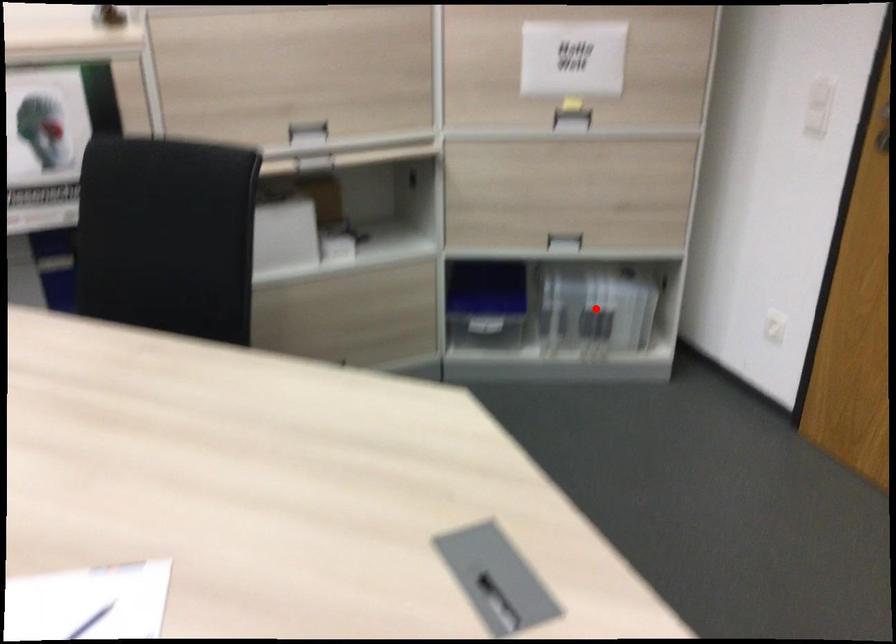
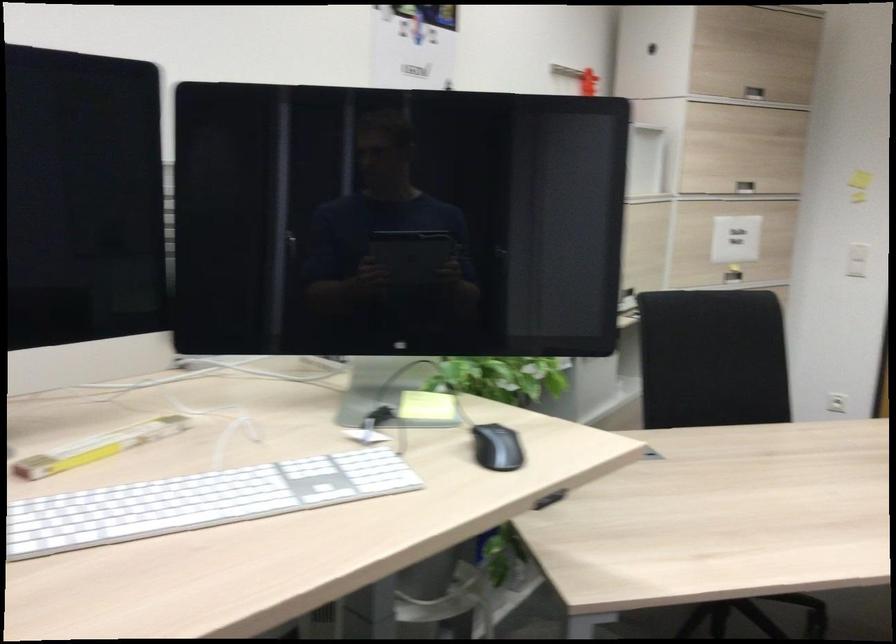
Question: I am providing you with two images of the same scene from different viewpoints. A red point is marked on the first image. Is the red point's position out of view in image 2?

Choices:
 (A) Yes
 (B) No

Answer: (A)